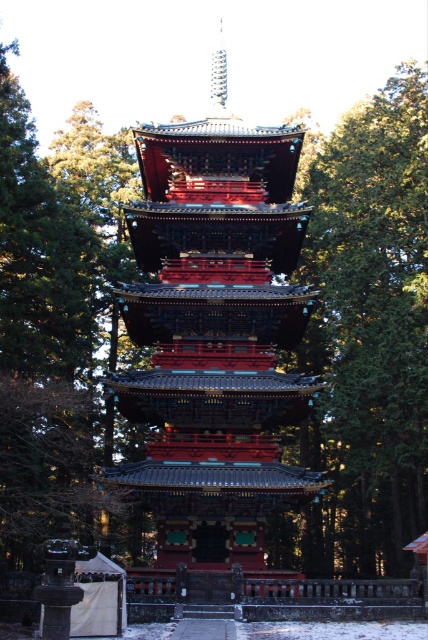
Question: Which point appears closest to the camera in this image?

Choices:
 (A) (x=259, y=280)
 (B) (x=308, y=433)

Answer: (A)

Question: Considering the relative positions of shiny lacquered pagoda at center and green textured tree at center in the image provided, where is shiny lacquered pagoda at center located with respect to green textured tree at center?

Choices:
 (A) left
 (B) right

Answer: (A)

Question: Does shiny lacquered pagoda at center have a greater width compared to green textured tree at center?

Choices:
 (A) yes
 (B) no

Answer: (A)

Question: Is shiny lacquered pagoda at center closer to camera compared to green textured tree at center?

Choices:
 (A) no
 (B) yes

Answer: (B)

Question: Among these objects, which one is nearest to the camera?

Choices:
 (A) green textured tree at center
 (B) shiny lacquered pagoda at center

Answer: (B)